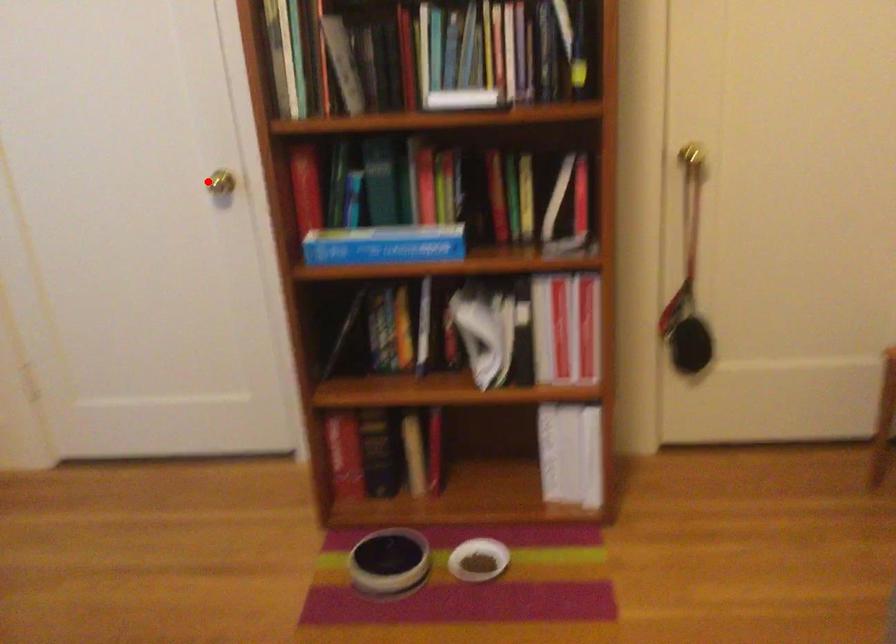
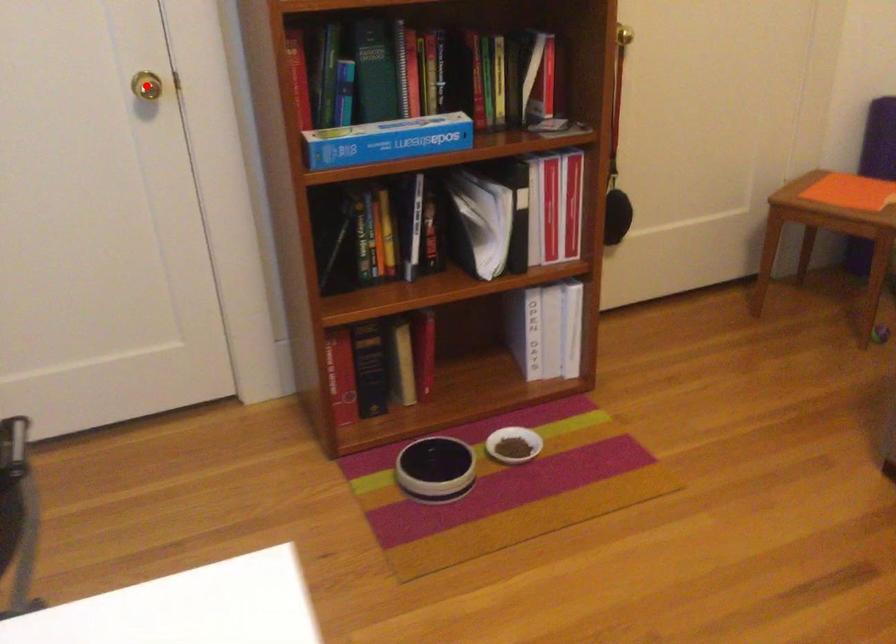
I am providing you with two images of the same scene from different viewpoints. A red point is marked on the first image and another point is marked on the second image. Is the red point in image1 aligned with the point shown in image2?

Yes